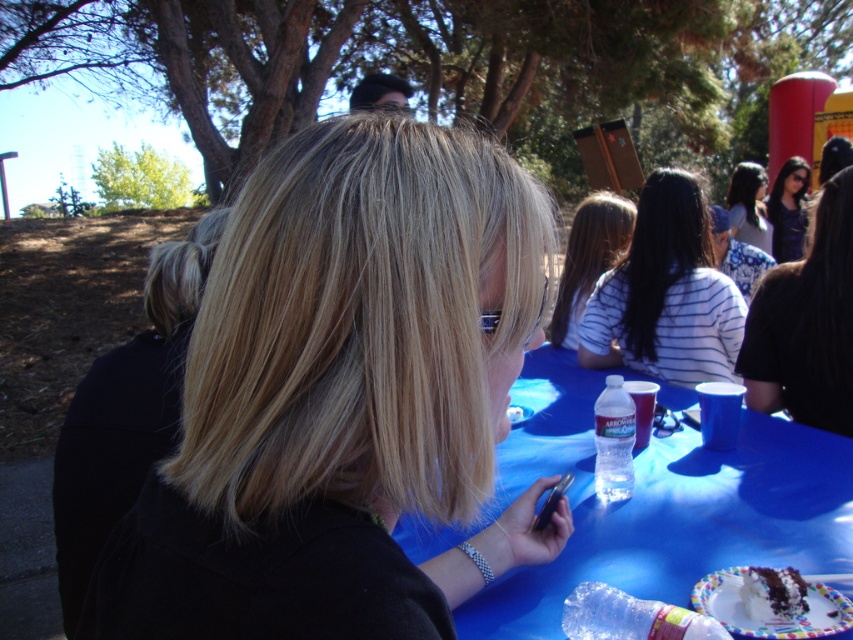
You are standing at the location of the person with shoulder length blonde hair wearing sunglasses and a black top. You want to hand a drink to the person with dark brown hair at upper right. Can you reach them without moving from your current position?

The dark brown hair at upper right and viewer are 1.99 meters apart, so you cannot reach them without moving from your current position since the distance is too far.

You are a photographer at the event and want to take a photo of the blonde smooth hair at center without any objects blocking the view. Is the chocolate frosted cake at lower right in front of or behind the person?

The chocolate frosted cake at lower right is behind the blonde smooth hair at center, so it won not block the view.

You are a waiter at this event and need to deliver a drink to the person with blonde smooth hair at center. The drink is currently placed on the table where the chocolate frosted cake at lower right is located. Can you reach the drink without moving the cake?

The distance between the blonde smooth hair at center and the chocolate frosted cake at lower right is 1.02 meters. Since the drink is on the same table as the cake, you can reach it without moving the cake as they are on the same table.